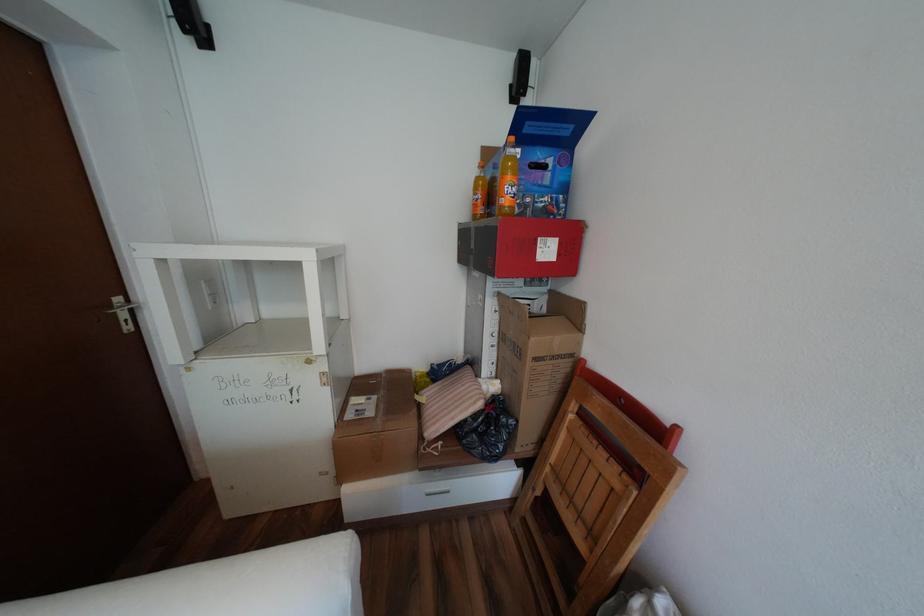
Where is `silver door handle`? The width and height of the screenshot is (924, 616). silver door handle is located at coordinates (120, 304).